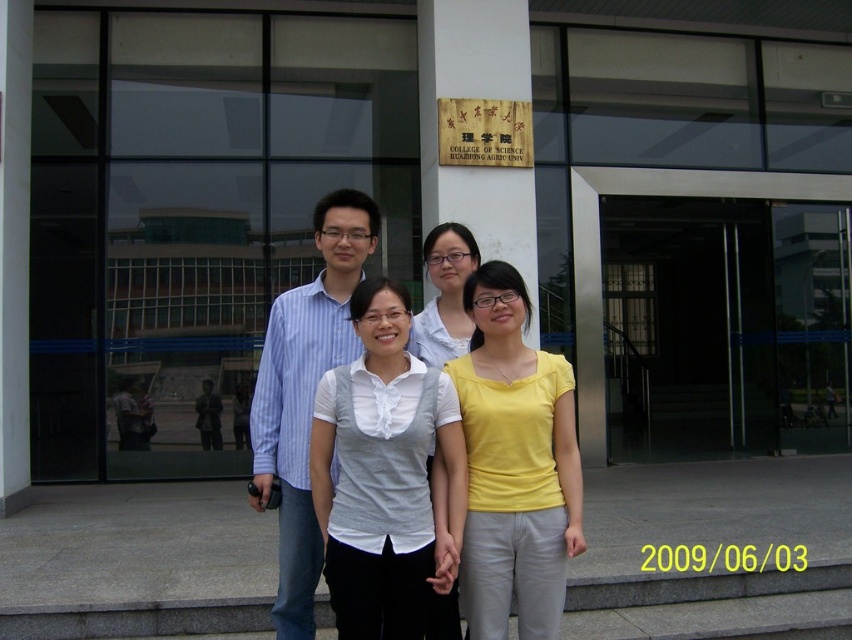
Question: Which of the following is the farthest from the observer?

Choices:
 (A) (300, 572)
 (B) (514, 531)

Answer: (A)

Question: Which object appears closest to the camera in this image?

Choices:
 (A) blue striped shirt at center
 (B) yellow matte shirt at center

Answer: (B)

Question: Which point appears farthest from the camera in this image?

Choices:
 (A) (346, 592)
 (B) (258, 486)
 (C) (304, 490)
 (D) (475, 433)

Answer: (B)

Question: Is white matte shirt at center to the right of matte white blouse at center from the viewer's perspective?

Choices:
 (A) no
 (B) yes

Answer: (A)

Question: Is blue striped shirt at center smaller than matte white blouse at center?

Choices:
 (A) yes
 (B) no

Answer: (B)

Question: Is yellow matte shirt at center to the left of blue striped shirt at center from the viewer's perspective?

Choices:
 (A) yes
 (B) no

Answer: (B)